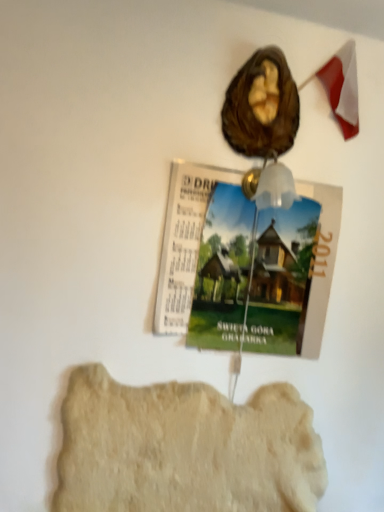
Question: From a real-world perspective, is light beige stone at lower center physically below green paper magazine at upper center?

Choices:
 (A) yes
 (B) no

Answer: (A)

Question: From the image's perspective, does light beige stone at lower center appear lower than green paper magazine at upper center?

Choices:
 (A) yes
 (B) no

Answer: (A)

Question: Is light beige stone at lower center far from green paper magazine at upper center?

Choices:
 (A) yes
 (B) no

Answer: (B)

Question: Can you confirm if light beige stone at lower center is thinner than green paper magazine at upper center?

Choices:
 (A) yes
 (B) no

Answer: (B)

Question: Is light beige stone at lower center smaller than green paper magazine at upper center?

Choices:
 (A) no
 (B) yes

Answer: (A)

Question: Can you confirm if light beige stone at lower center is positioned to the left of green paper magazine at upper center?

Choices:
 (A) yes
 (B) no

Answer: (A)

Question: Is green paper magazine at upper center aimed at brown matte walnut at upper center?

Choices:
 (A) no
 (B) yes

Answer: (A)

Question: Is green paper magazine at upper center shorter than brown matte walnut at upper center?

Choices:
 (A) yes
 (B) no

Answer: (B)

Question: Does green paper magazine at upper center appear on the right side of brown matte walnut at upper center?

Choices:
 (A) yes
 (B) no

Answer: (B)

Question: Can you confirm if green paper magazine at upper center is wider than brown matte walnut at upper center?

Choices:
 (A) no
 (B) yes

Answer: (A)

Question: Considering the relative positions of green paper magazine at upper center and brown matte walnut at upper center in the image provided, is green paper magazine at upper center to the left of brown matte walnut at upper center from the viewer's perspective?

Choices:
 (A) yes
 (B) no

Answer: (A)

Question: Does green paper magazine at upper center have a smaller size compared to brown matte walnut at upper center?

Choices:
 (A) no
 (B) yes

Answer: (A)

Question: Is green paper magazine at upper center to the left of light beige stone at lower center from the viewer's perspective?

Choices:
 (A) no
 (B) yes

Answer: (A)